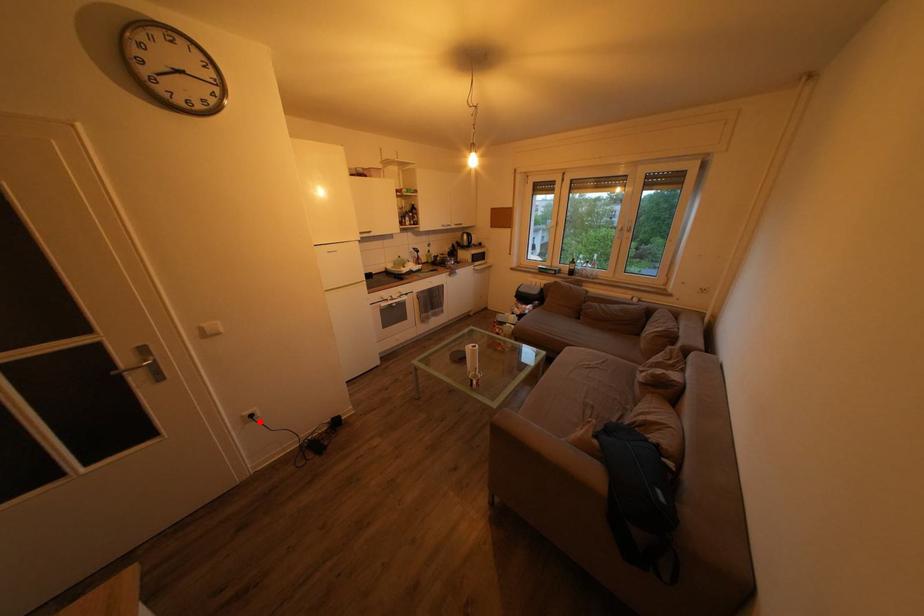
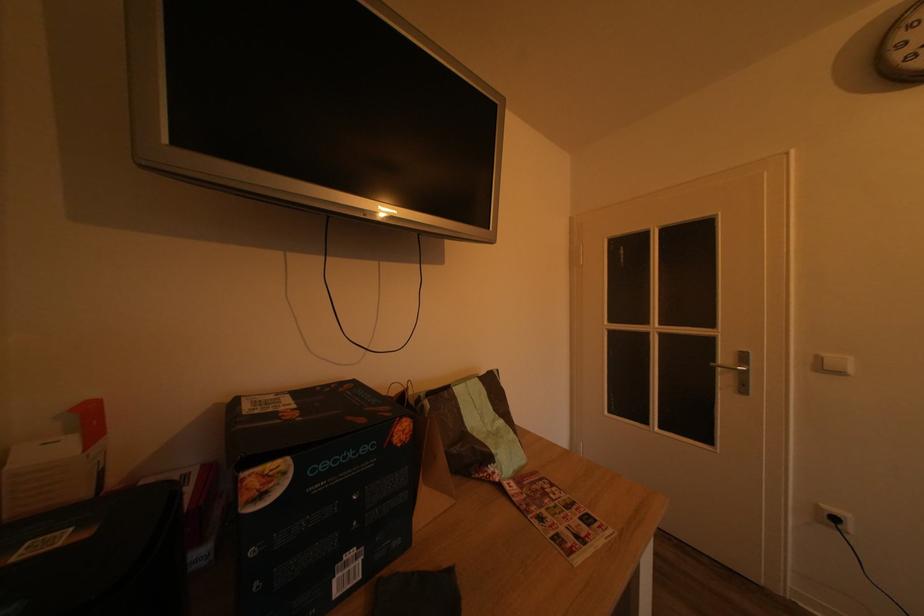
The point at the highlighted location is marked in the first image. Where is the corresponding point in the second image?

(843, 525)